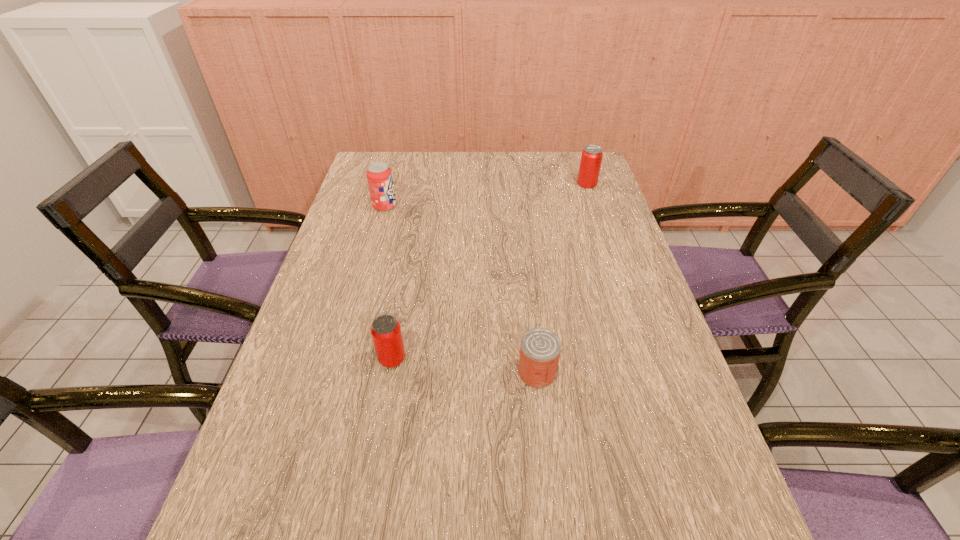
At what (x,y) coordinates should I click in order to perform the action: click on free space located 0.250m on the right of the shortest can. Please return your answer as a coordinate pair (x, y). The image size is (960, 540). Looking at the image, I should click on (670, 373).

The height and width of the screenshot is (540, 960). Find the location of `object present at the far edge`. object present at the far edge is located at coordinates (591, 158).

At what (x,y) coordinates should I click in order to perform the action: click on object present at the left edge. Please return your answer as a coordinate pair (x, y). Looking at the image, I should click on (379, 176).

Where is `object present at the right edge`? The image size is (960, 540). object present at the right edge is located at coordinates (591, 158).

The width and height of the screenshot is (960, 540). What are the coordinates of `object that is at the far right corner` in the screenshot? It's located at (591, 158).

At what (x,y) coordinates should I click in order to perform the action: click on free location at the far edge of the desktop. Please return your answer as a coordinate pair (x, y). The image size is (960, 540). Looking at the image, I should click on (450, 176).

Find the location of a particular element. vacant region at the left edge of the desktop is located at coordinates 266,414.

At what (x,y) coordinates should I click in order to perform the action: click on vacant space at the right edge of the desktop. Please return your answer as a coordinate pair (x, y). Image resolution: width=960 pixels, height=540 pixels. Looking at the image, I should click on click(x=600, y=230).

At what (x,y) coordinates should I click in order to perform the action: click on vacant region between the shortest can and the farthest object. Please return your answer as a coordinate pair (x, y). The width and height of the screenshot is (960, 540). Looking at the image, I should click on (562, 278).

This screenshot has height=540, width=960. What are the coordinates of `free spot between the third object from left to right and the rightmost object` in the screenshot? It's located at (562, 278).